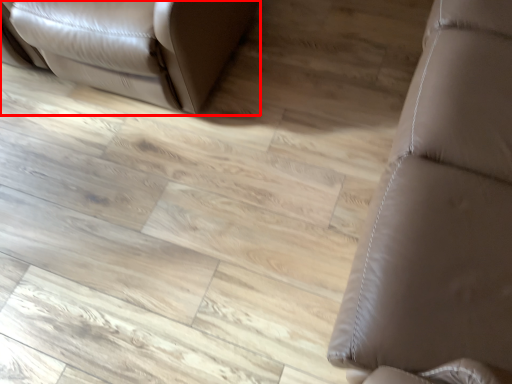
Question: From the image's perspective, where is furniture (annotated by the red box) located in relation to furniture in the image?

Choices:
 (A) above
 (B) below

Answer: (A)